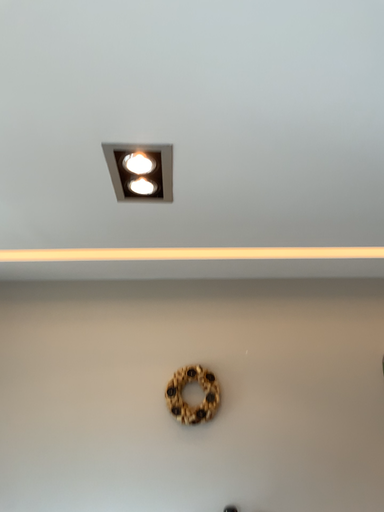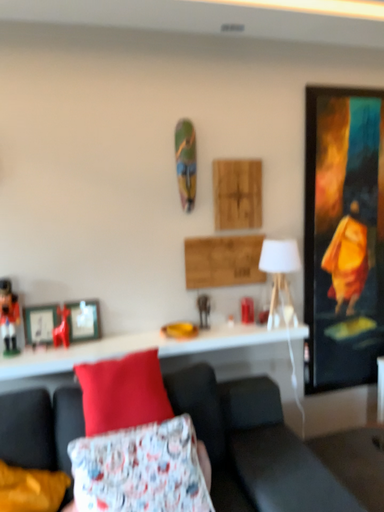
Question: How did the camera likely rotate when shooting the video?

Choices:
 (A) rotated right
 (B) rotated left

Answer: (A)